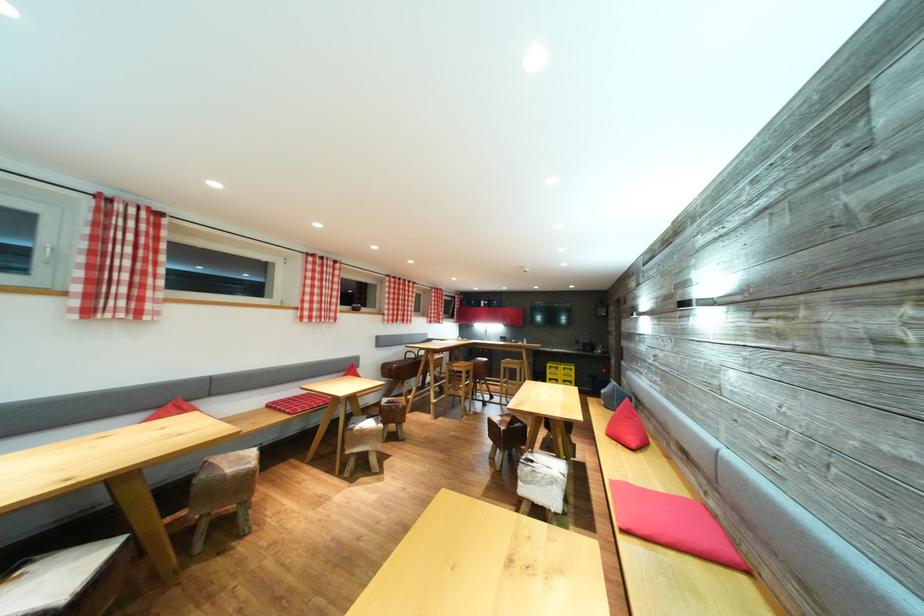
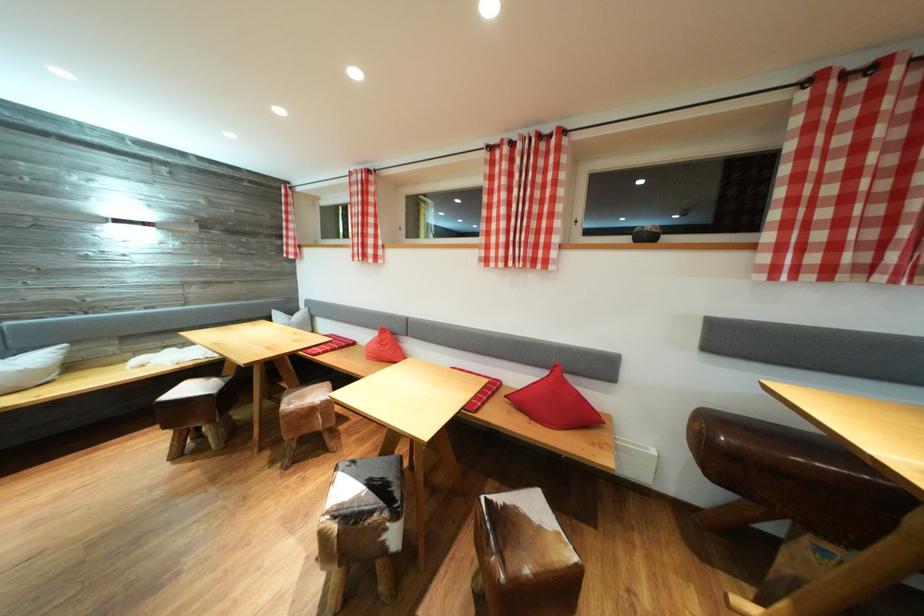
Where in the second image is the point corresponding to (x=309, y=323) from the first image?

(492, 265)